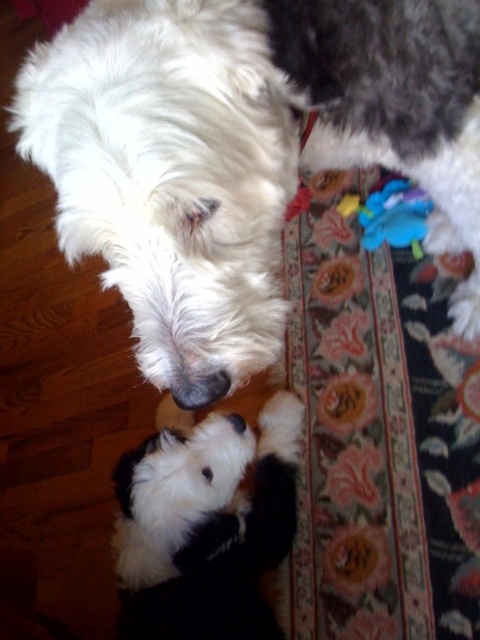
You are taking a photo of two dogs lying on a rug. You want to focus on the dog that is closer to the camera. Which point should you focus on, point (64, 99) or point (377, 232)?

You should focus on point (64, 99) because it is closer to the camera than point (377, 232).

Looking at this image, you are a photographer trying to capture both the white fluffy dog at upper left and the blue fabric toy at center in a single shot. Based on their positions, which object is closer to the left edge of the photo?

The white fluffy dog at upper left is closer to the left edge of the photo because it is positioned on the left side of the blue fabric toy at center.

You are a small dog lying on the rug. You want to reach the blue fabric toy at center and the black fur nose at center. Which object is wider?

The blue fabric toy at center is wider than the black fur nose at center according to the description.